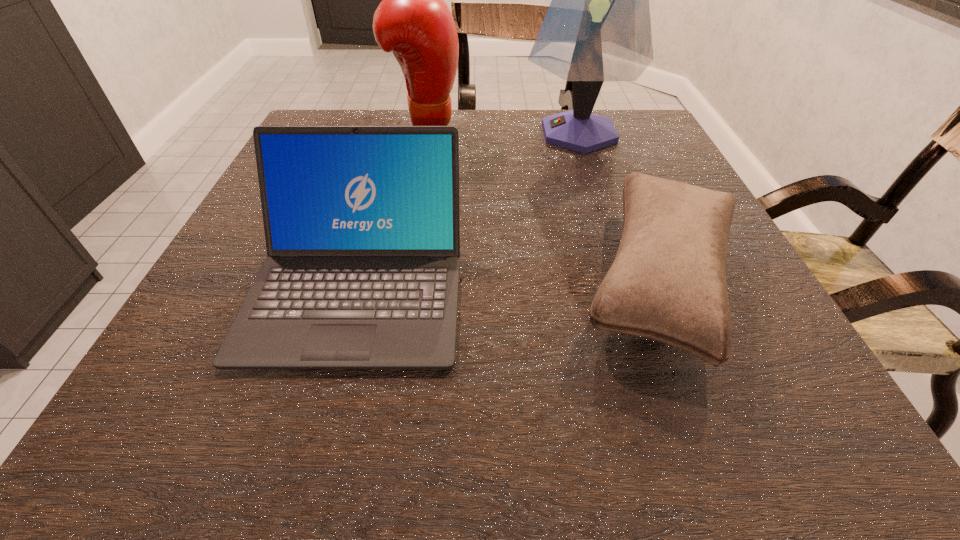
The height and width of the screenshot is (540, 960). In order to click on vacant region between the shortest object and the lampshade in this screenshot , I will do `click(619, 206)`.

This screenshot has width=960, height=540. In order to click on the second closest object to the third tallest object in this screenshot , I will do `click(597, 28)`.

Where is `the closest object to the boxing glove`? This screenshot has height=540, width=960. the closest object to the boxing glove is located at coordinates (597, 28).

This screenshot has width=960, height=540. What are the coordinates of `vacant area in the image that satisfies the following two spatial constraints: 1. on the base of the tallest object; 2. on the screen of the second shortest object` in the screenshot? It's located at (629, 284).

Where is `vacant space that satisfies the following two spatial constraints: 1. on the striking surface of the boxing glove; 2. on the screen of the third tallest object`? This screenshot has width=960, height=540. vacant space that satisfies the following two spatial constraints: 1. on the striking surface of the boxing glove; 2. on the screen of the third tallest object is located at coordinates (396, 284).

You are a GUI agent. You are given a task and a screenshot of the screen. Output one action in this format:
    pyautogui.click(x=<x>, y=<y>)
    Task: Click on the free spot that satisfies the following two spatial constraints: 1. on the striking surface of the second tallest object; 2. on the left side of the shortest object
    This screenshot has height=540, width=960.
    Given the screenshot: What is the action you would take?
    pyautogui.click(x=397, y=279)

I want to click on vacant space that satisfies the following two spatial constraints: 1. on the striking surface of the second tallest object; 2. on the screen of the laptop computer, so click(x=396, y=284).

You are a GUI agent. You are given a task and a screenshot of the screen. Output one action in this format:
    pyautogui.click(x=<x>, y=<y>)
    Task: Click on the vacant position in the image that satisfies the following two spatial constraints: 1. on the back side of the cushion; 2. on the striking surface of the second tallest object
    Image resolution: width=960 pixels, height=540 pixels.
    Given the screenshot: What is the action you would take?
    pyautogui.click(x=598, y=129)

This screenshot has width=960, height=540. What are the coordinates of `vacant space that satisfies the following two spatial constraints: 1. on the striking surface of the boxing glove; 2. on the screen of the second shortest object` in the screenshot? It's located at (396, 284).

Where is `free space that satisfies the following two spatial constraints: 1. on the striking surface of the second tallest object; 2. on the screen of the laptop computer`? This screenshot has width=960, height=540. free space that satisfies the following two spatial constraints: 1. on the striking surface of the second tallest object; 2. on the screen of the laptop computer is located at coordinates (396, 284).